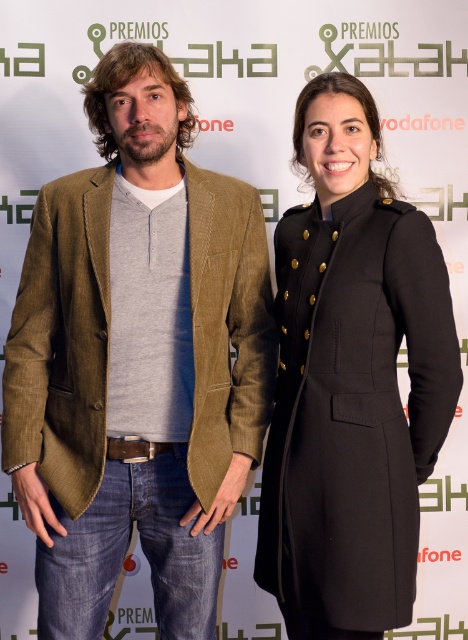
You are a fashion designer observing the two individuals in the image. You need to determine which item, the matte brown blazer at center or the brown leather belt at center, is taller. Which one is taller?

The matte brown blazer at center is taller than the brown leather belt at center according to the description.

Based on the scene description, which object is wider, the matte brown blazer at center or the brown leather belt at center?

The matte brown blazer at center is wider than the brown leather belt at center according to the description.

You are a photographer setting up for a group photo. You need to position two people so that their clothing items, the matte brown blazer at center and the black wool coat at center, are exactly 30 centimeters apart. Based on the current setup, do you need to move them closer or farther apart?

The matte brown blazer at center is currently 29.96 centimeters away from the black wool coat at center. Since this is just slightly less than 30 centimeters, you need to move them about 0.04 centimeters farther apart to reach the desired distance.